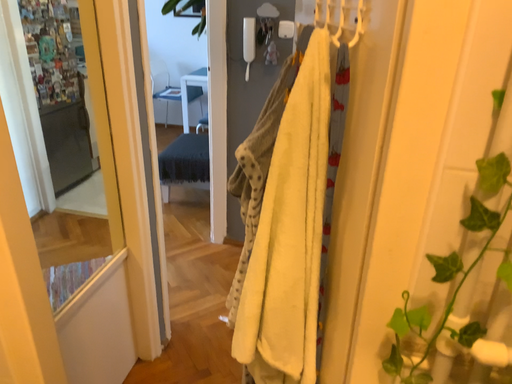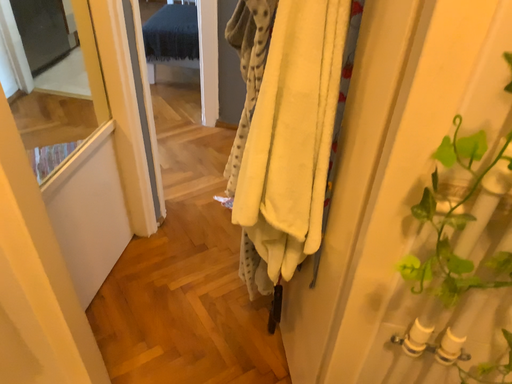
Question: Which way did the camera rotate in the video?

Choices:
 (A) rotated upward
 (B) rotated downward

Answer: (B)